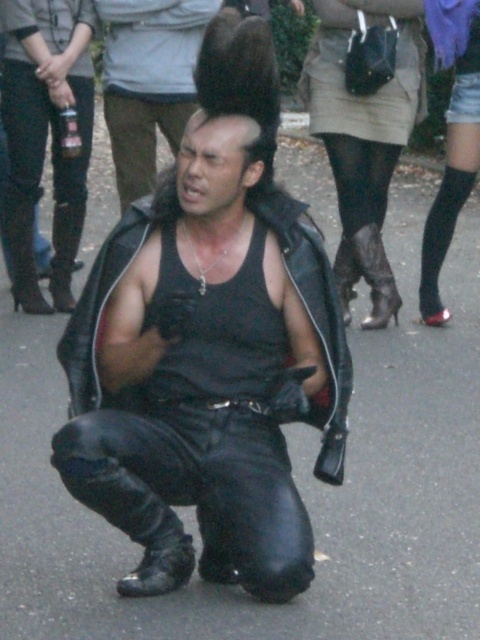
Consider the image. You are a photographer trying to capture a closeup of the black leather jacket at center. The camera you are using has a focal length of 85mm and a maximum aperture of f1.4. You want to ensure the jacket is in sharp focus while blurring the background. What should you do with the aperture setting?

To ensure the black leather jacket at center is in sharp focus while blurring the background, you should set the aperture to the lowest possible value, which in this case is f1.4. This will create a shallow depth of field, keeping the jacket in focus and blurring the background.

You are a photographer trying to capture a closeup of the person in the image. Which object, the black leather jacket at center or the black leather boot at left, should you focus on to ensure it appears clearer in the photo?

The black leather jacket at center is closer to the viewer than the black leather boot at left, so focusing on the black leather jacket at center will ensure it appears clearer in the photo.